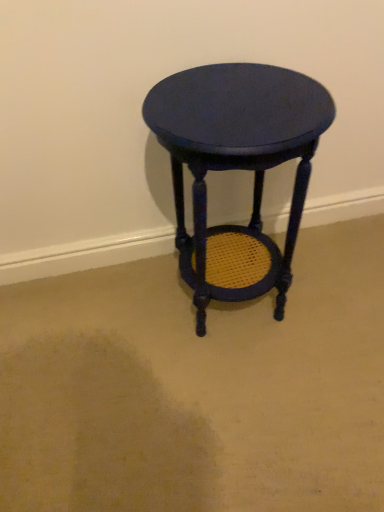
Identify the location of free spot above matte black stool at center (from a real-world perspective). (239, 97).